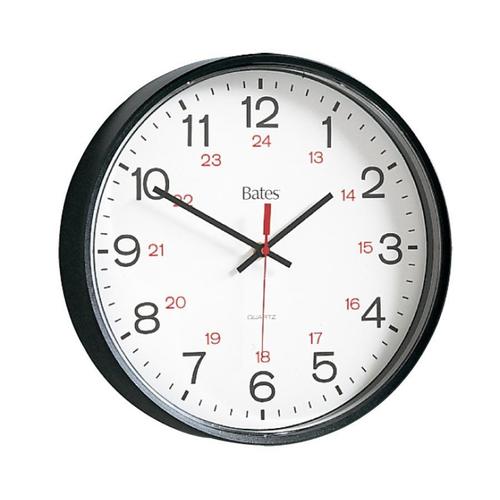
Locate an element on the screen. The image size is (500, 500). clock is located at coordinates (373, 214).